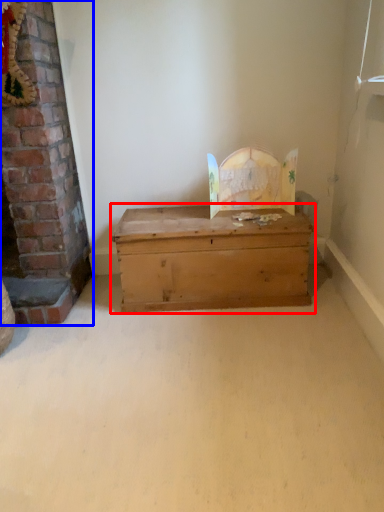
Question: Which point is closer to the camera, table (highlighted by a red box) or fireplace (highlighted by a blue box)?

Choices:
 (A) table
 (B) fireplace

Answer: (B)